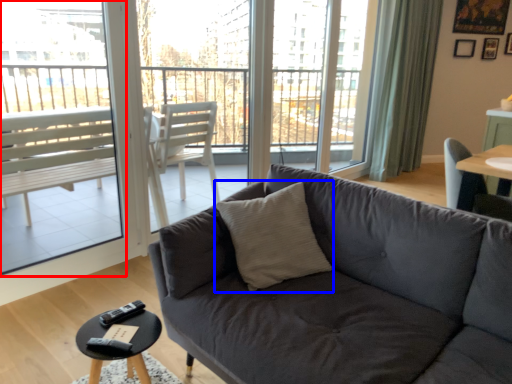
Question: Which of the following is the farthest to the observer, window screen (highlighted by a red box) or throw pillow (highlighted by a blue box)?

Choices:
 (A) window screen
 (B) throw pillow

Answer: (A)